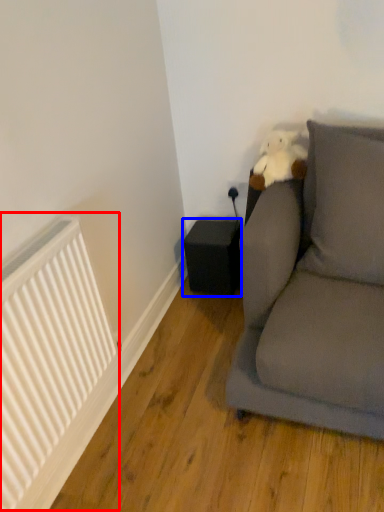
Question: Which point is closer to the camera, radiator (highlighted by a red box) or speaker (highlighted by a blue box)?

Choices:
 (A) radiator
 (B) speaker

Answer: (A)